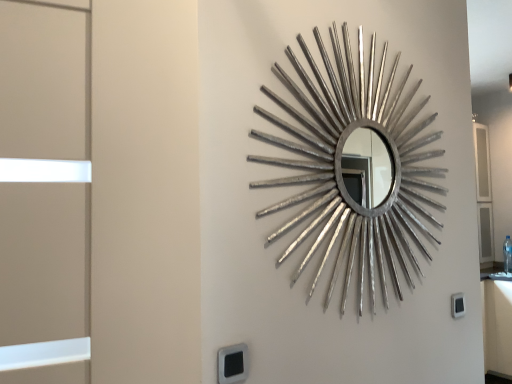
What do you see at coordinates (457, 305) in the screenshot?
I see `black plastic electric outlet at lower right, which is the 2th electric outlet from left to right` at bounding box center [457, 305].

Image resolution: width=512 pixels, height=384 pixels. Find the location of `black plastic electric outlet at lower center, the first electric outlet when ordered from left to right`. black plastic electric outlet at lower center, the first electric outlet when ordered from left to right is located at coordinates [232, 363].

From the picture: Does silver metallic mirror at center lie behind black plastic electric outlet at lower right, which is the 2th electric outlet from left to right?

No, the depth of silver metallic mirror at center is less than that of black plastic electric outlet at lower right, which is the 2th electric outlet from left to right.

Looking at this image, is silver metallic mirror at center looking in the opposite direction of black plastic electric outlet at lower right, which is the 2th electric outlet from left to right?

No, silver metallic mirror at center's orientation is not away from black plastic electric outlet at lower right, which is the 2th electric outlet from left to right.

Does point (349, 363) appear closer or farther from the camera than point (455, 299)?

Point (349, 363) is positioned closer to the camera compared to point (455, 299).

Is silver metallic mirror at center in contact with black plastic electric outlet at lower right, which appears as the 1th electric outlet when viewed from the right?

No, silver metallic mirror at center is not touching black plastic electric outlet at lower right, which appears as the 1th electric outlet when viewed from the right.

Locate an element on the screen. electric outlet below the black plastic electric outlet at lower center, the first electric outlet when ordered from left to right (from the image's perspective) is located at coordinates (457, 305).

How different are the orientations of black plastic electric outlet at lower center, the first electric outlet when ordered from left to right, and black plastic electric outlet at lower right, which appears as the 1th electric outlet when viewed from the right, in degrees?

black plastic electric outlet at lower center, the first electric outlet when ordered from left to right, and black plastic electric outlet at lower right, which appears as the 1th electric outlet when viewed from the right, are facing 0.754 degrees away from each other.

In the scene shown: Considering the relative sizes of black plastic electric outlet at lower center, the first electric outlet in the front-to-back sequence, and black plastic electric outlet at lower right, which is the 2th electric outlet from left to right, in the image provided, is black plastic electric outlet at lower center, the first electric outlet in the front-to-back sequence, thinner than black plastic electric outlet at lower right, which is the 2th electric outlet from left to right,?

No, black plastic electric outlet at lower center, the first electric outlet in the front-to-back sequence, is not thinner than black plastic electric outlet at lower right, which is the 2th electric outlet from left to right.

From the image's perspective, is black plastic electric outlet at lower center, the first electric outlet when ordered from left to right, below black plastic electric outlet at lower right, which is the 2th electric outlet from left to right?

Incorrect, from the image's perspective, black plastic electric outlet at lower center, the first electric outlet when ordered from left to right, is higher than black plastic electric outlet at lower right, which is the 2th electric outlet from left to right.

Which is more to the left, black plastic electric outlet at lower right, arranged as the 2th electric outlet when viewed from the front, or black plastic electric outlet at lower center, which ranks as the 2th electric outlet in right-to-left order?

black plastic electric outlet at lower center, which ranks as the 2th electric outlet in right-to-left order.

Considering the relative sizes of black plastic electric outlet at lower right, which appears as the 1th electric outlet when viewed from the right, and black plastic electric outlet at lower center, the first electric outlet when ordered from left to right, in the image provided, is black plastic electric outlet at lower right, which appears as the 1th electric outlet when viewed from the right, taller than black plastic electric outlet at lower center, the first electric outlet when ordered from left to right,?

Incorrect, the height of black plastic electric outlet at lower right, which appears as the 1th electric outlet when viewed from the right, is not larger of that of black plastic electric outlet at lower center, the first electric outlet when ordered from left to right.

Is black plastic electric outlet at lower right, which appears as the 1th electric outlet when viewed from the right, wider than black plastic electric outlet at lower center, the first electric outlet when ordered from left to right?

No, black plastic electric outlet at lower right, which appears as the 1th electric outlet when viewed from the right, is not wider than black plastic electric outlet at lower center, the first electric outlet when ordered from left to right.

Considering the sizes of objects black plastic electric outlet at lower right, which appears as the 1th electric outlet when viewed from the right, and black plastic electric outlet at lower center, the first electric outlet when ordered from left to right, in the image provided, who is bigger, black plastic electric outlet at lower right, which appears as the 1th electric outlet when viewed from the right, or black plastic electric outlet at lower center, the first electric outlet when ordered from left to right,?

black plastic electric outlet at lower center, the first electric outlet when ordered from left to right, is bigger.

Between black plastic electric outlet at lower center, the second electric outlet in the back-to-front sequence, and silver metallic mirror at center, which one has less height?

Standing shorter between the two is black plastic electric outlet at lower center, the second electric outlet in the back-to-front sequence.

Would you say black plastic electric outlet at lower center, which ranks as the 2th electric outlet in right-to-left order, contains silver metallic mirror at center?

Definitely not — silver metallic mirror at center is not inside black plastic electric outlet at lower center, which ranks as the 2th electric outlet in right-to-left order.

In terms of size, does black plastic electric outlet at lower center, the first electric outlet when ordered from left to right, appear bigger or smaller than silver metallic mirror at center?

Considering their sizes, black plastic electric outlet at lower center, the first electric outlet when ordered from left to right, takes up less space than silver metallic mirror at center.

Is black plastic electric outlet at lower center, which ranks as the 2th electric outlet in right-to-left order, to the left of silver metallic mirror at center from the viewer's perspective?

Correct, you'll find black plastic electric outlet at lower center, which ranks as the 2th electric outlet in right-to-left order, to the left of silver metallic mirror at center.

Is black plastic electric outlet at lower right, which appears as the 1th electric outlet when viewed from the right, positioned behind silver metallic mirror at center?

Yes, it is.

Can you confirm if black plastic electric outlet at lower right, which appears as the 1th electric outlet when viewed from the right, is smaller than silver metallic mirror at center?

Yes.

In the scene shown: Is black plastic electric outlet at lower right, the 1th electric outlet from the back, taller than silver metallic mirror at center?

In fact, black plastic electric outlet at lower right, the 1th electric outlet from the back, may be shorter than silver metallic mirror at center.

Is silver metallic mirror at center in front of or behind black plastic electric outlet at lower center, the second electric outlet in the back-to-front sequence, in the image?

Visually, silver metallic mirror at center is located behind black plastic electric outlet at lower center, the second electric outlet in the back-to-front sequence.

From the picture: Does silver metallic mirror at center have a greater height compared to black plastic electric outlet at lower center, the first electric outlet when ordered from left to right?

Correct, silver metallic mirror at center is much taller as black plastic electric outlet at lower center, the first electric outlet when ordered from left to right.

From the image's perspective, is silver metallic mirror at center located above or below black plastic electric outlet at lower center, the second electric outlet in the back-to-front sequence?

silver metallic mirror at center is above black plastic electric outlet at lower center, the second electric outlet in the back-to-front sequence.

Where is `backdrop above the black plastic electric outlet at lower right, arranged as the 2th electric outlet when viewed from the front (from a real-world perspective)`? backdrop above the black plastic electric outlet at lower right, arranged as the 2th electric outlet when viewed from the front (from a real-world perspective) is located at coordinates coord(300,207).

The height and width of the screenshot is (384, 512). Identify the location of electric outlet lying in front of the black plastic electric outlet at lower right, which is the 2th electric outlet from left to right. (232, 363).

From the picture: Which object lies nearer to the anchor point silver metallic mirror at center, black plastic electric outlet at lower center, the second electric outlet in the back-to-front sequence, or black plastic electric outlet at lower right, the 1th electric outlet from the back?

black plastic electric outlet at lower right, the 1th electric outlet from the back, is positioned closer to the anchor silver metallic mirror at center.

Based on their spatial positions, is silver metallic mirror at center or black plastic electric outlet at lower right, arranged as the 2th electric outlet when viewed from the front, closer to black plastic electric outlet at lower center, which ranks as the 2th electric outlet in right-to-left order?

Based on the image, silver metallic mirror at center appears to be nearer to black plastic electric outlet at lower center, which ranks as the 2th electric outlet in right-to-left order.

Looking at the image, which one is located closer to black plastic electric outlet at lower right, which appears as the 1th electric outlet when viewed from the right, black plastic electric outlet at lower center, the first electric outlet when ordered from left to right, or silver metallic mirror at center?

silver metallic mirror at center is closer to black plastic electric outlet at lower right, which appears as the 1th electric outlet when viewed from the right.

Which object lies further to the anchor point silver metallic mirror at center, black plastic electric outlet at lower right, the 1th electric outlet from the back, or black plastic electric outlet at lower center, the first electric outlet when ordered from left to right?

Among the two, black plastic electric outlet at lower center, the first electric outlet when ordered from left to right, is located further to silver metallic mirror at center.

Considering their positions, is silver metallic mirror at center positioned closer to black plastic electric outlet at lower right, which appears as the 1th electric outlet when viewed from the right, than black plastic electric outlet at lower center, the first electric outlet in the front-to-back sequence?

Among the two, silver metallic mirror at center is located nearer to black plastic electric outlet at lower right, which appears as the 1th electric outlet when viewed from the right.

Which object lies further to the anchor point black plastic electric outlet at lower center, the first electric outlet in the front-to-back sequence, black plastic electric outlet at lower right, the 1th electric outlet from the back, or silver metallic mirror at center?

black plastic electric outlet at lower right, the 1th electric outlet from the back, lies further to black plastic electric outlet at lower center, the first electric outlet in the front-to-back sequence, than the other object.

Find the location of a particular element. backdrop between black plastic electric outlet at lower center, the first electric outlet when ordered from left to right, and black plastic electric outlet at lower right, which appears as the 1th electric outlet when viewed from the right is located at coordinates (300, 207).